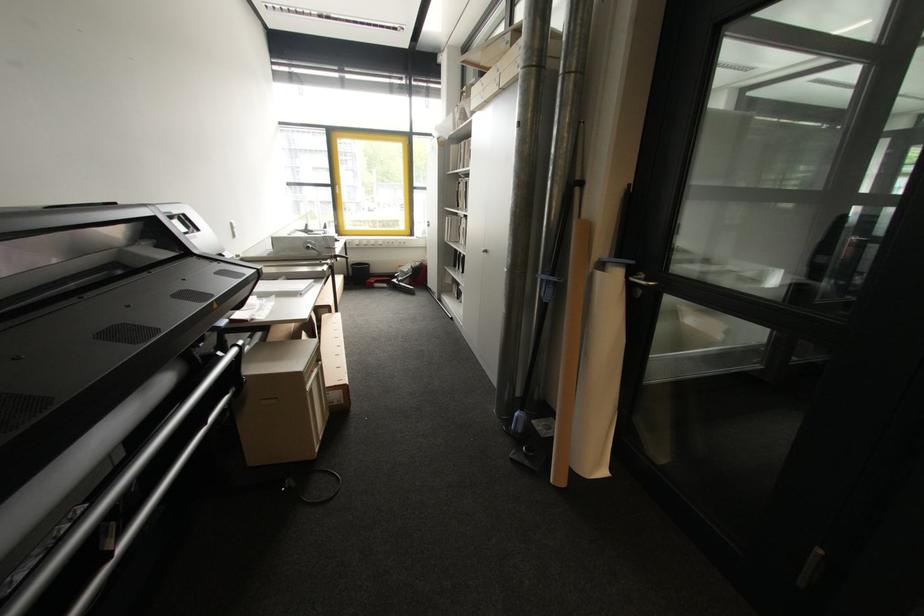
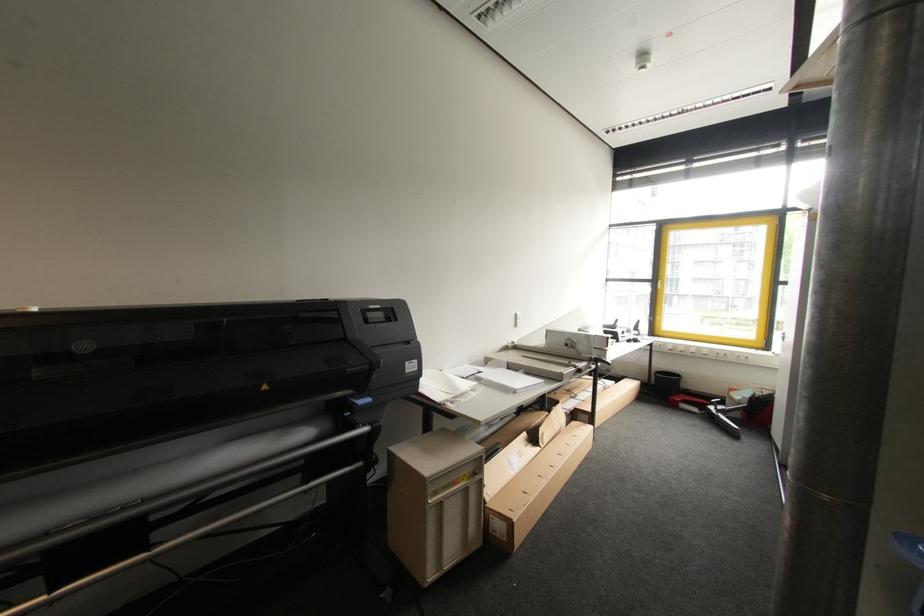
Where in the second image is the point corresponding to [341,395] from the first image?

(503, 527)